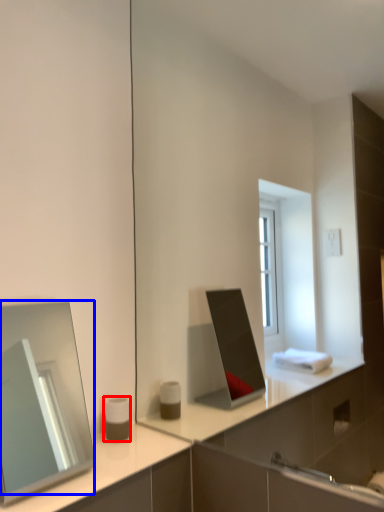
Question: Which of the following is the closest to the observer, toiletry (highlighted by a red box) or mirror (highlighted by a blue box)?

Choices:
 (A) toiletry
 (B) mirror

Answer: (B)